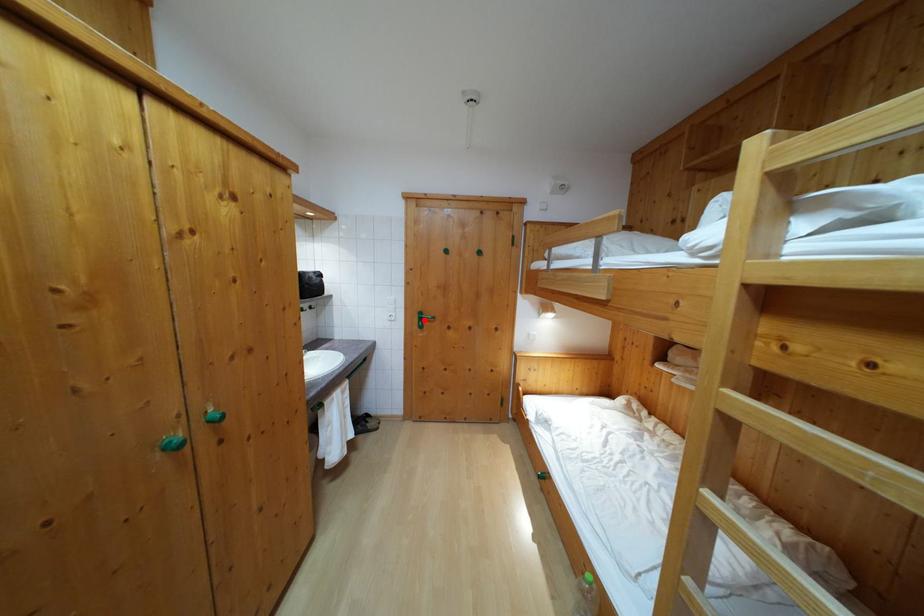
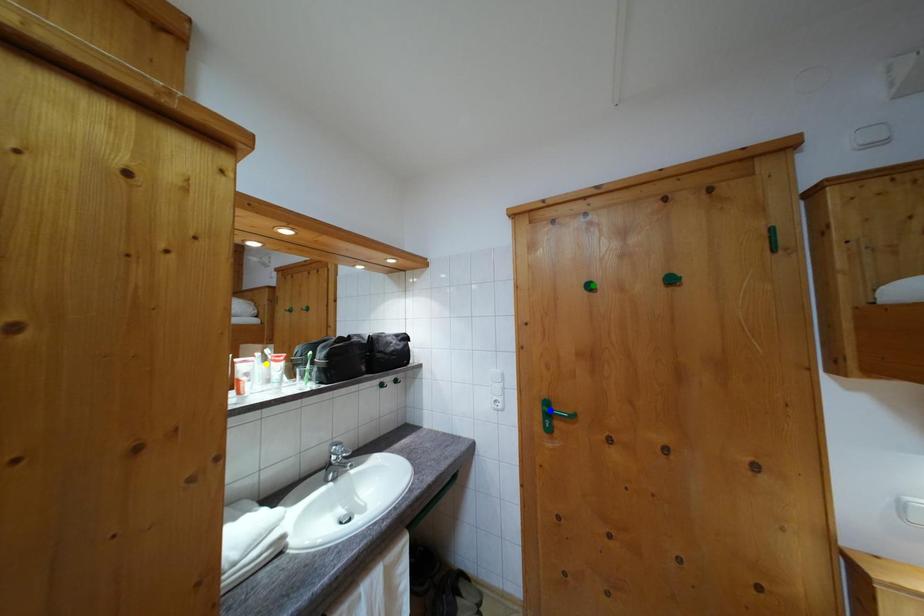
Question: I am providing you with two images of the same scene from different viewpoints. A red point is marked on the first image. You are given multiple points on the second image. Can you choose the point in image 2 that corresponds to the point in image 1?

Choices:
 (A) yellow point
 (B) green point
 (C) blue point

Answer: (C)